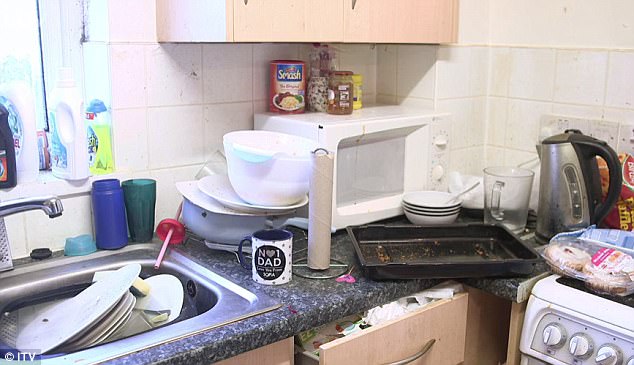
Image resolution: width=634 pixels, height=365 pixels. Identify the location of bottom of wall cabinet. (292, 22).